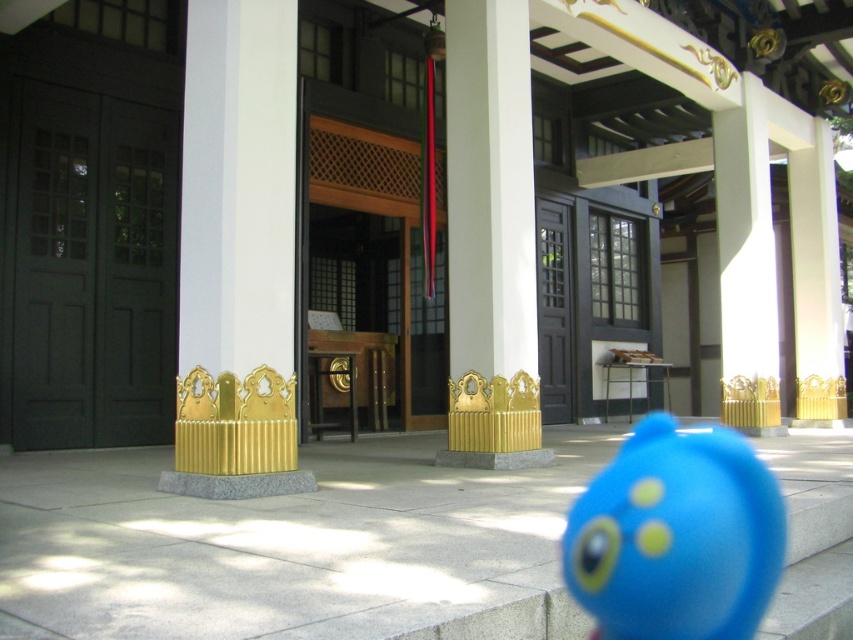
You are standing at the entrance of the traditional building and need to locate the matte dark green door at left. According to the scene description, where would you find this door relative to the small bright blue object in the bottom right corner?

The matte dark green door at left is positioned to the left side of the entrance, while the small bright blue object is near the bottom right corner. Based on their coordinates, the door is at point (90, 272), which places it to the left and slightly above the blue object located at the bottom right.

You are standing at the entrance of the traditional building and want to locate the matte dark green door at left. According to the coordinates provided, where exactly should you look to find it?

The matte dark green door at left is located at the 2D coordinates point (x=90, y=272).